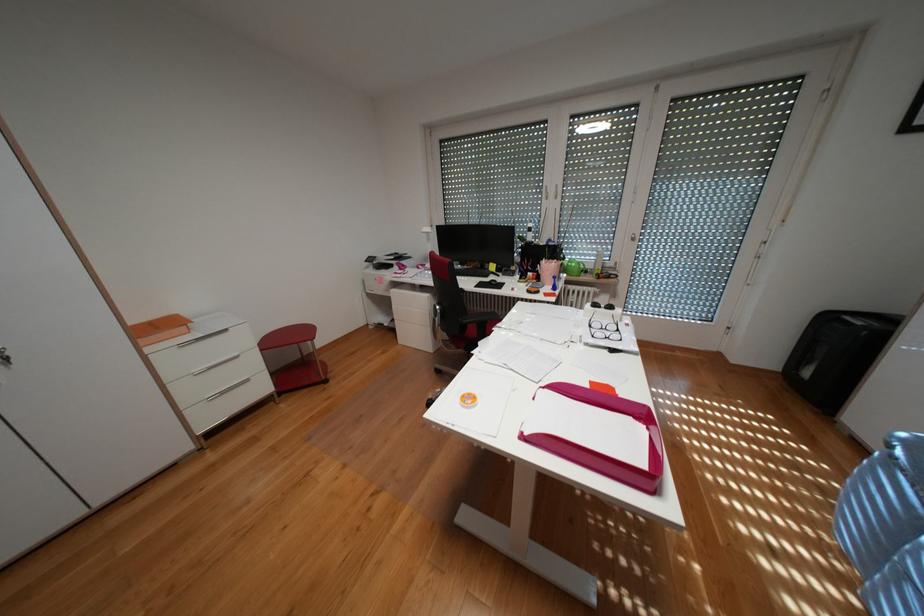
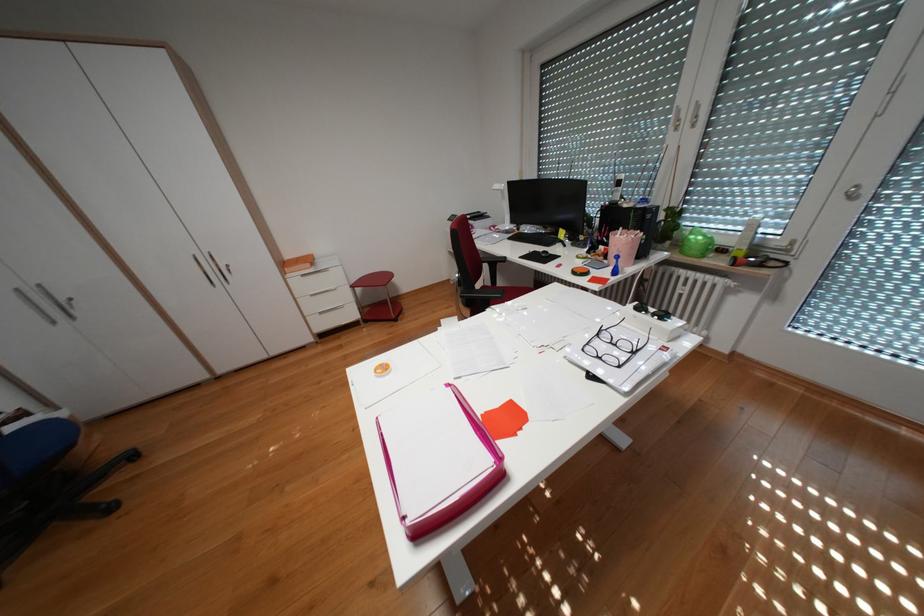
The point at (551, 277) is marked in the first image. Where is the corresponding point in the second image?

(618, 254)